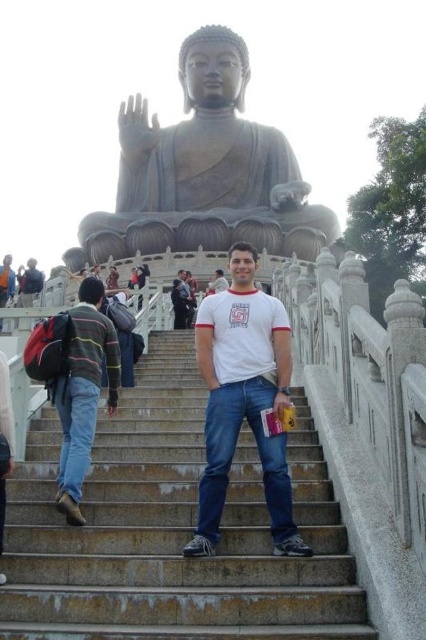
Question: Observing the image, what is the correct spatial positioning of smooth stone stairs at center in reference to white cotton t-shirt at center?

Choices:
 (A) above
 (B) below

Answer: (B)

Question: Which point is farther to the camera?

Choices:
 (A) smooth stone stairs at center
 (B) matte gray statue at center
 (C) white cotton t-shirt at center

Answer: (B)

Question: Which of the following is the farthest from the observer?

Choices:
 (A) dark gray stone statue at upper center
 (B) smooth stone stairs at center
 (C) matte gray statue at center

Answer: (C)

Question: Is white cotton t-shirt at center thinner than striped sweater at left?

Choices:
 (A) no
 (B) yes

Answer: (A)

Question: Is smooth stone stairs at center bigger than matte gray statue at center?

Choices:
 (A) yes
 (B) no

Answer: (B)

Question: Among these points, which one is farthest from the camera?

Choices:
 (A) (86, 403)
 (B) (94, 592)
 (C) (262, 236)
 (D) (175, 300)

Answer: (C)